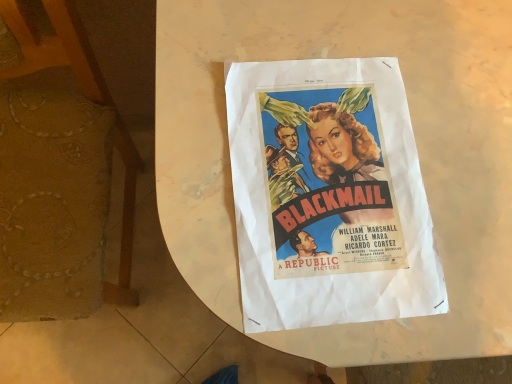
You are a GUI agent. You are given a task and a screenshot of the screen. Output one action in this format:
    pyautogui.click(x=<x>, y=<y>)
    Task: Click on the vacant area situated to the left side of matte paper poster at center
    
    Given the screenshot: What is the action you would take?
    pyautogui.click(x=197, y=122)